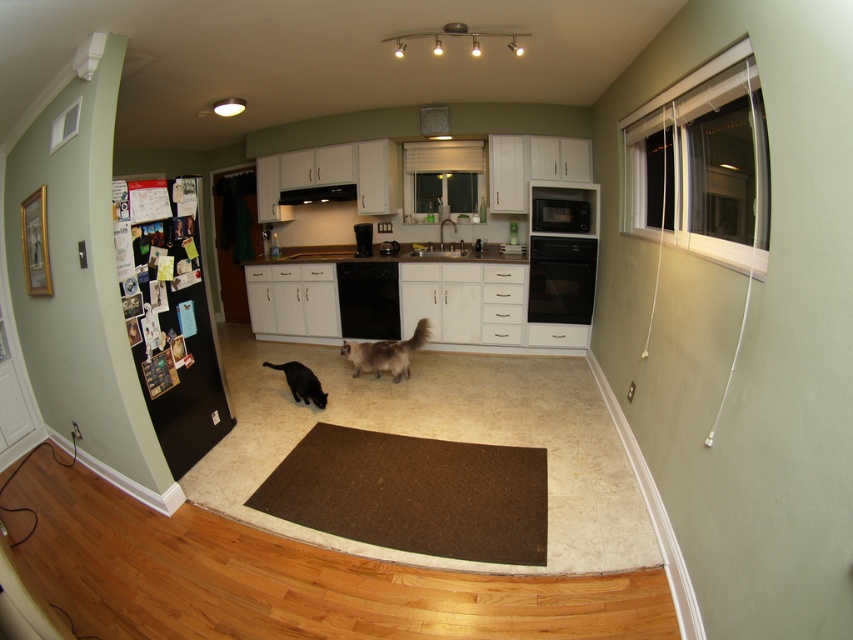
Question: Which point is closer to the camera?

Choices:
 (A) black glossy dishwasher at center
 (B) fuzzy white cat at center

Answer: (B)

Question: Is black matte oven at center positioned at the back of black matte microwave at center?

Choices:
 (A) no
 (B) yes

Answer: (A)

Question: Does brown rubber doormat at center appear over black matte dishwasher at center?

Choices:
 (A) yes
 (B) no

Answer: (B)

Question: Does brown rubber doormat at center have a larger size compared to black glossy dishwasher at center?

Choices:
 (A) no
 (B) yes

Answer: (B)

Question: Estimate the real-world distances between objects in this image. Which object is closer to the black glossy dishwasher at center?

Choices:
 (A) brown rubber doormat at center
 (B) black matte dishwasher at center
 (C) black matte oven at center

Answer: (B)

Question: Which of the following is the farthest from the observer?

Choices:
 (A) (321, 188)
 (B) (405, 355)
 (C) (396, 456)

Answer: (A)